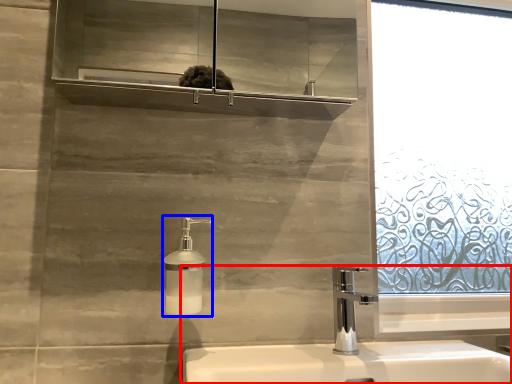
Question: Which object appears closest to the camera in this image, sink (highlighted by a red box) or soap dispenser (highlighted by a blue box)?

Choices:
 (A) sink
 (B) soap dispenser

Answer: (A)